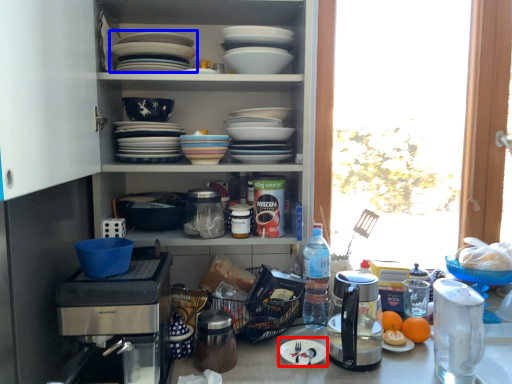
Question: Which point is closer to the camera, paper plate (highlighted by a red box) or platter (highlighted by a blue box)?

Choices:
 (A) paper plate
 (B) platter

Answer: (B)